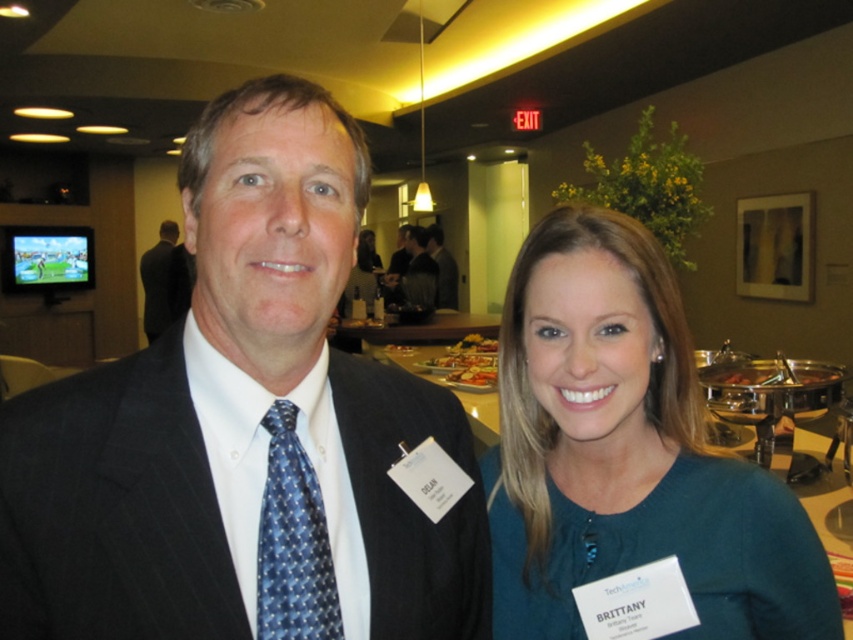
Does teal sweater at center lie in front of dark gray suit at center?

That is True.

Is point (558, 604) positioned after point (428, 252)?

That is False.

Is point (592, 380) closer to viewer compared to point (444, 278)?

Yes, point (592, 380) is in front of point (444, 278).

The height and width of the screenshot is (640, 853). In order to click on teal sweater at center in this screenshot , I will do `click(627, 452)`.

Can you confirm if blue dotted tie at left is bigger than blue dotted tie at center?

Incorrect, blue dotted tie at left is not larger than blue dotted tie at center.

Is blue dotted tie at left wider than blue dotted tie at center?

Incorrect, blue dotted tie at left's width does not surpass blue dotted tie at center's.

At what (x,y) coordinates should I click in order to perform the action: click on blue dotted tie at left. Please return your answer as a coordinate pair (x, y). Image resolution: width=853 pixels, height=640 pixels. Looking at the image, I should click on (293, 541).

Which of these two, blue dotted tie at left or dark gray suit at center, stands taller?

With more height is dark gray suit at center.

Where is `blue dotted tie at left`? blue dotted tie at left is located at coordinates (293, 541).